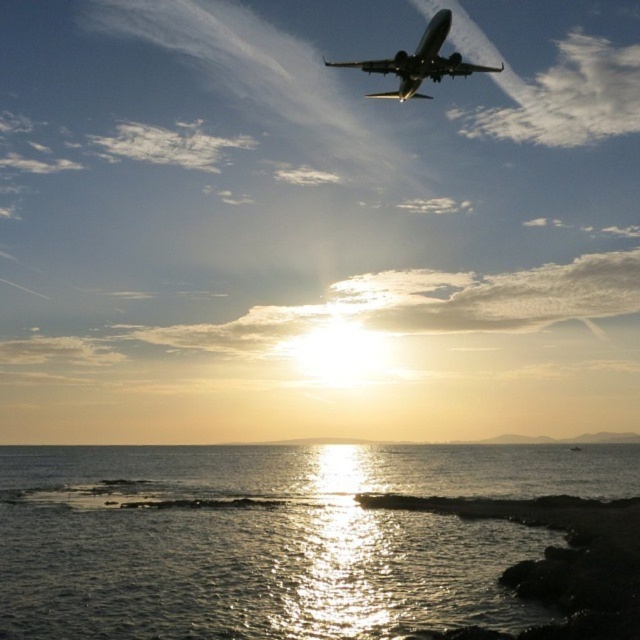
From the picture: You are a photographer trying to capture the metallic silver airplane at upper center and the shiny reflective water at lower center in the same frame. Based on their positions, which object will appear closer to the bottom of your photo?

The shiny reflective water at lower center will appear closer to the bottom of your photo because it is positioned below the metallic silver airplane at upper center.

You are standing at the edge of the coast looking at the sunset scene. There are two points marked in the image, one at coordinates point (276, 593) and another at point (422, 35). Which of these two points appears closer to you in the image?

Point (276, 593) is closer to the viewer than point (422, 35).

You are standing at the camera position observing the coastal scene. There is a specific point marked at coordinates point (266, 464). If you want to throw a pebble to reach that point, what is the minimum distance you need to throw it?

The point (266, 464) is 130.41 meters away from the camera position, so you need to throw the pebble at least 130.41 meters to reach it.